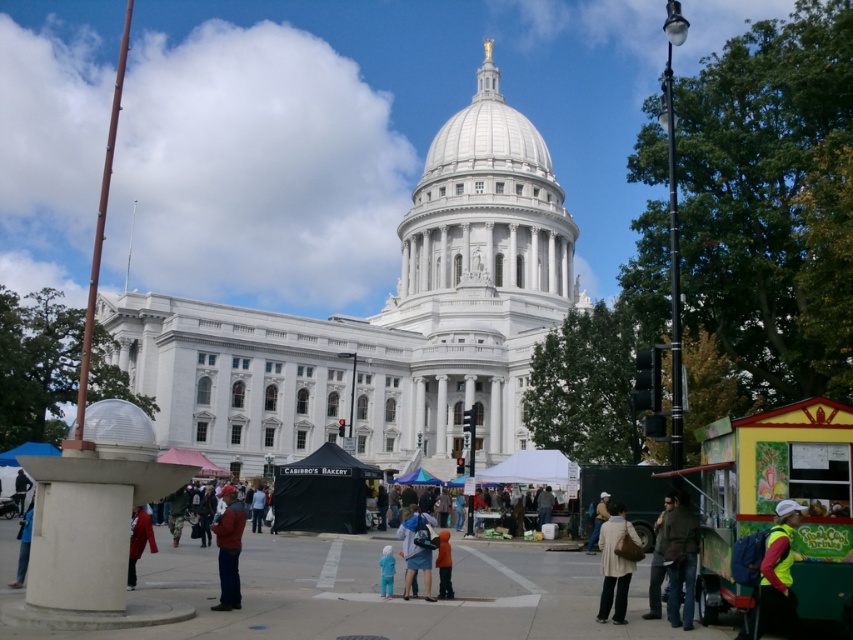
Question: Is brown leather jacket at lower right positioned in front of orange fabric at center?

Choices:
 (A) yes
 (B) no

Answer: (A)

Question: Does multicolored fabric crowd at center appear on the left side of light brown leather jacket at center?

Choices:
 (A) no
 (B) yes

Answer: (A)

Question: Which object appears farthest from the camera in this image?

Choices:
 (A) dark green jacket at lower right
 (B) blue fabric at center
 (C) red knit hat at center
 (D) brown leather jacket at lower right

Answer: (B)

Question: Is the position of white marble dome at center more distant than that of red knit hat at center?

Choices:
 (A) yes
 (B) no

Answer: (A)

Question: Which point is closer to the camera?

Choices:
 (A) (666, 493)
 (B) (131, 557)
 (C) (222, 490)
 (D) (781, 554)

Answer: (D)

Question: Which point is farther to the camera?

Choices:
 (A) click(x=259, y=504)
 (B) click(x=637, y=547)
 (C) click(x=654, y=557)

Answer: (A)